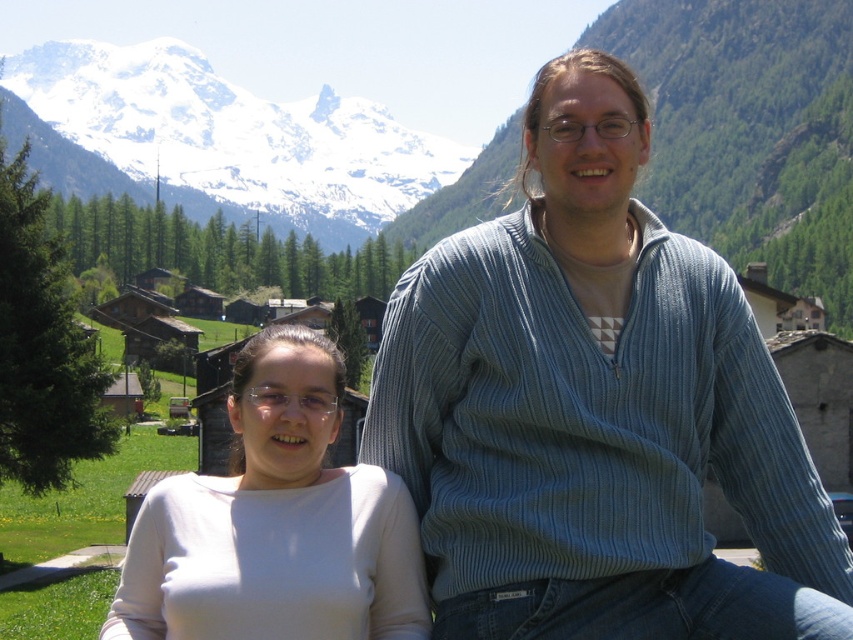
Is blue striped sweater at center smaller than snowy mountain at upper left?

Yes, blue striped sweater at center is smaller than snowy mountain at upper left.

The image size is (853, 640). What do you see at coordinates (596, 410) in the screenshot?
I see `blue striped sweater at center` at bounding box center [596, 410].

You are a GUI agent. You are given a task and a screenshot of the screen. Output one action in this format:
    pyautogui.click(x=<x>, y=<y>)
    Task: Click on the blue striped sweater at center
    The width and height of the screenshot is (853, 640).
    Given the screenshot: What is the action you would take?
    pyautogui.click(x=596, y=410)

Does blue striped sweater at center appear over white matte shirt at lower left?

Indeed, blue striped sweater at center is positioned over white matte shirt at lower left.

Is blue striped sweater at center taller than white matte shirt at lower left?

Correct, blue striped sweater at center is much taller as white matte shirt at lower left.

Where is `blue striped sweater at center`? The height and width of the screenshot is (640, 853). blue striped sweater at center is located at coordinates (596, 410).

Locate an element on the screen. This screenshot has height=640, width=853. blue striped sweater at center is located at coordinates (596, 410).

In the scene shown: Is white matte shirt at lower left positioned behind snowy mountain at upper left?

That is False.

The width and height of the screenshot is (853, 640). Describe the element at coordinates (276, 524) in the screenshot. I see `white matte shirt at lower left` at that location.

Between point (128, 561) and point (399, 173), which one is positioned in front?

Point (128, 561)

Locate an element on the screen. This screenshot has width=853, height=640. white matte shirt at lower left is located at coordinates (276, 524).